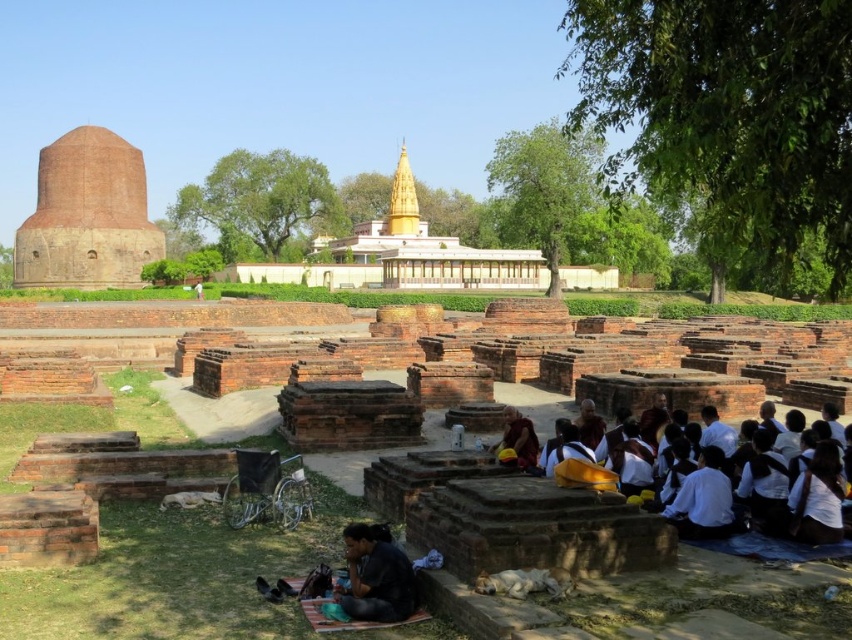
You are a photographer standing at the camera position. You want to take a photo that includes both the group of people in the foreground and the ruins in the midground. However, you notice that one of the points, either point (x=26, y=285) or point (x=521, y=416), is closer to you. Which point should you focus on to ensure both the foreground and midground elements are in sharp focus?

You should focus on point (x=26, y=285) because it is closer to the camera than point (x=521, y=416). By focusing on the closer point, the depth of field will extend to cover both the foreground group and the midground ruins more effectively.

You are a visitor at this historical site and want to take a photo of the brick stupa at left. Where should you position yourself to capture it in the frame?

The brick stupa at left is located at point (87, 216), so you should position yourself to the left side of the scene to capture it in your photo.